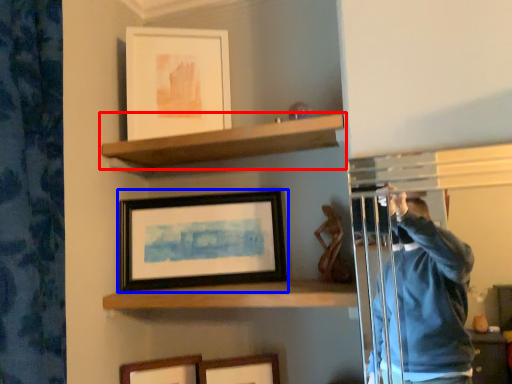
Question: Which object appears farthest to the camera in this image, shelf (highlighted by a red box) or picture frame (highlighted by a blue box)?

Choices:
 (A) shelf
 (B) picture frame

Answer: (B)